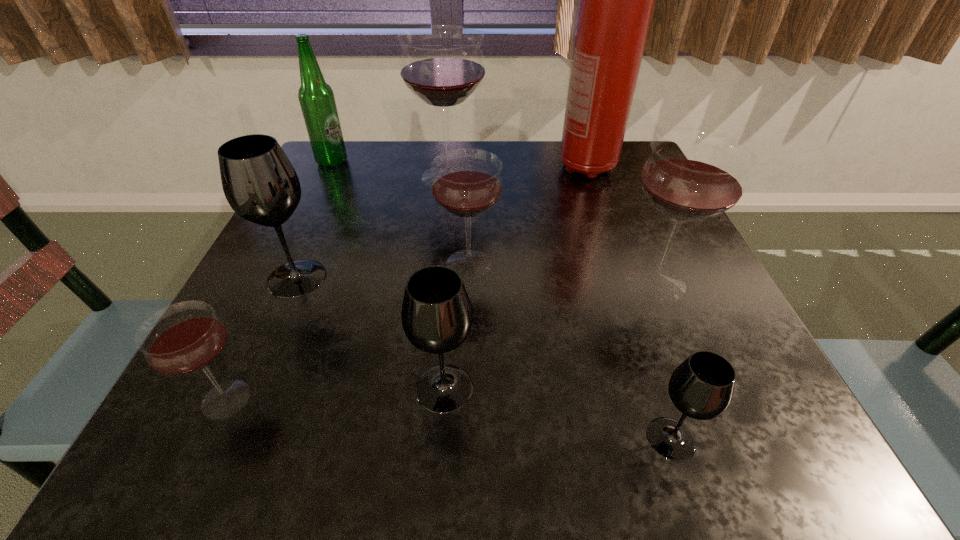
The image size is (960, 540). In order to click on wineglass that can be found as the second closest to the nearest gray wineglass in this screenshot , I will do `click(436, 314)`.

You are a GUI agent. You are given a task and a screenshot of the screen. Output one action in this format:
    pyautogui.click(x=<x>, y=<y>)
    Task: Click on the closest wineglass to the red fire extinguisher
    
    Given the screenshot: What is the action you would take?
    [442, 65]

Identify which red wineglass is the fourth nearest to the farthest gray wineglass. Please provide its 2D coordinates. Your answer should be formatted as a tuple, i.e. [(x, y)], where the tuple contains the x and y coordinates of a point satisfying the conditions above.

[(692, 175)]

Choose which red wineglass is the nearest neighbor to the farthest red wineglass. Please provide its 2D coordinates. Your answer should be formatted as a tuple, i.e. [(x, y)], where the tuple contains the x and y coordinates of a point satisfying the conditions above.

[(467, 183)]

Identify which gray wineglass is located as the nearest to the leftmost red wineglass. Please provide its 2D coordinates. Your answer should be formatted as a tuple, i.e. [(x, y)], where the tuple contains the x and y coordinates of a point satisfying the conditions above.

[(259, 182)]

Locate which gray wineglass ranks in proximity to the second smallest red wineglass. Please provide its 2D coordinates. Your answer should be formatted as a tuple, i.e. [(x, y)], where the tuple contains the x and y coordinates of a point satisfying the conditions above.

[(436, 314)]

Find the location of a particular element. free location that satisfies the following two spatial constraints: 1. on the label of the beer bottle; 2. on the right side of the third biggest red wineglass is located at coordinates (281, 264).

Locate an element on the screen. The width and height of the screenshot is (960, 540). free point that satisfies the following two spatial constraints: 1. on the label of the nearest gray wineglass; 2. on the left side of the green beer bottle is located at coordinates (194, 439).

At what (x,y) coordinates should I click in order to perform the action: click on vacant region that satisfies the following two spatial constraints: 1. on the label of the green beer bottle; 2. on the back side of the rightmost gray wineglass. Please return your answer as a coordinate pair (x, y). Looking at the image, I should click on (194, 439).

This screenshot has width=960, height=540. What are the coordinates of `vacant area that satisfies the following two spatial constraints: 1. on the label of the green beer bottle; 2. on the right side of the third biggest red wineglass` in the screenshot? It's located at (281, 264).